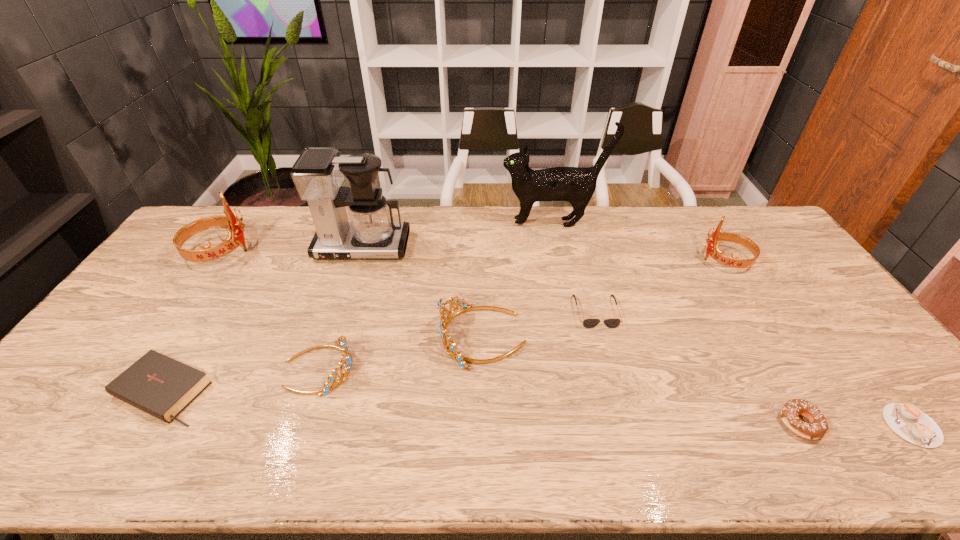
Where is `cappuccino positioned at the right edge`? cappuccino positioned at the right edge is located at coordinates (x=906, y=420).

I want to click on object at the far left corner, so click(235, 237).

This screenshot has height=540, width=960. Find the location of `object present at the near right corner`. object present at the near right corner is located at coordinates (906, 420).

In the image, there is a desktop. Where is `free space at the far edge`? The width and height of the screenshot is (960, 540). free space at the far edge is located at coordinates (597, 236).

The height and width of the screenshot is (540, 960). In order to click on blank area at the near edge in this screenshot , I will do `click(610, 447)`.

The width and height of the screenshot is (960, 540). In the image, there is a desktop. Identify the location of vacant space at the left edge. (85, 407).

At what (x,y) coordinates should I click in order to perform the action: click on free point at the right edge. Please return your answer as a coordinate pair (x, y). Looking at the image, I should click on (792, 280).

Locate an element on the screen. This screenshot has width=960, height=540. free space at the far left corner of the desktop is located at coordinates (248, 210).

Where is `free space at the near left corner`? Image resolution: width=960 pixels, height=540 pixels. free space at the near left corner is located at coordinates click(45, 450).

Identify the location of vacant space at the far right corner. The image size is (960, 540). (717, 217).